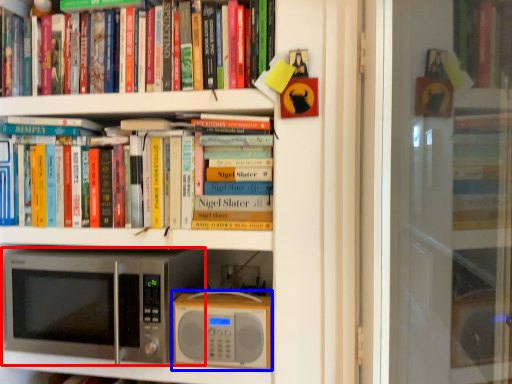
Question: Among these objects, which one is nearest to the camera, microwave oven (highlighted by a red box) or appliance (highlighted by a blue box)?

Choices:
 (A) microwave oven
 (B) appliance

Answer: (A)